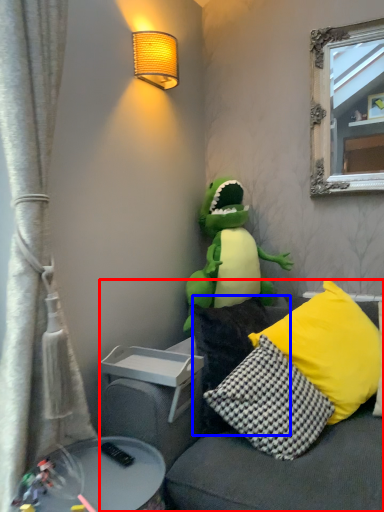
Question: Which point is closer to the camera, studio couch (highlighted by a red box) or pillow (highlighted by a blue box)?

Choices:
 (A) studio couch
 (B) pillow

Answer: (A)